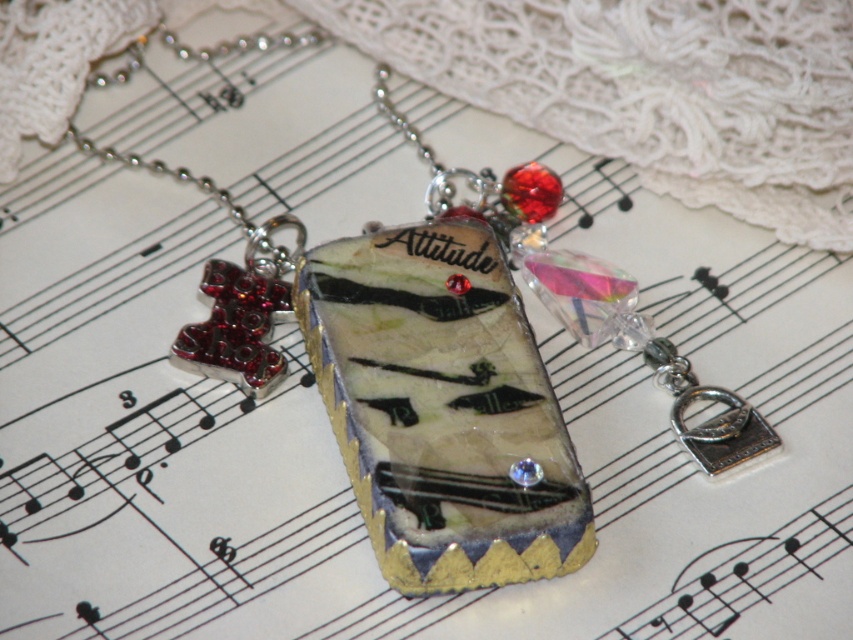
Locate an element on the screen. translucent resin pendant at center is located at coordinates click(x=442, y=408).

Who is lower down, translucent resin pendant at center or translucent glass pendant at center?

translucent resin pendant at center is below.

Is point (431, 460) more distant than point (563, 259)?

No, it is not.

Image resolution: width=853 pixels, height=640 pixels. Identify the location of translucent resin pendant at center. (442, 408).